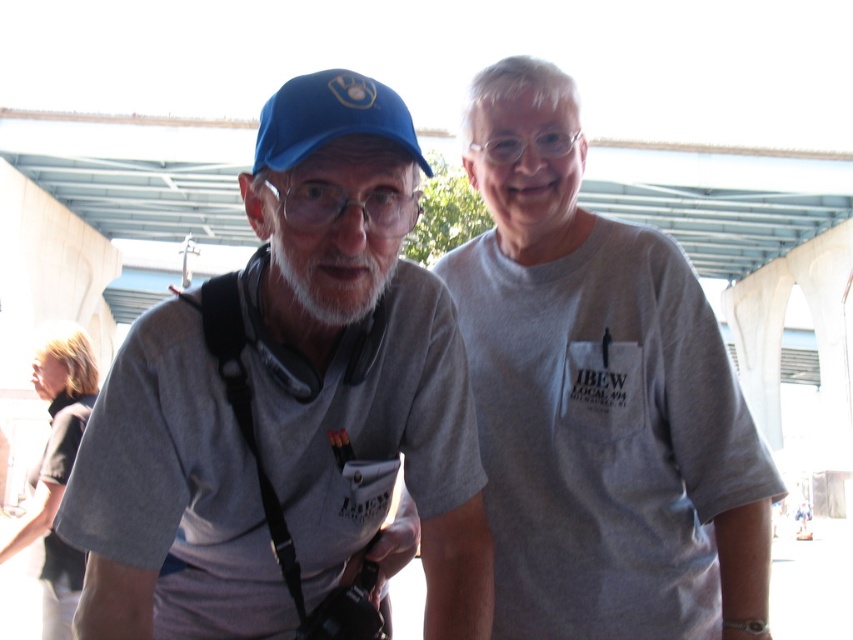
How distant is blue fabric baseball cap at upper left from whitehairbeard at center?

blue fabric baseball cap at upper left and whitehairbeard at center are 5.66 feet apart.

What are the coordinates of `blue fabric baseball cap at upper left` in the screenshot? It's located at (329, 116).

Does gray cotton t-shirt at center have a larger size compared to dark gray shirt at lower left?

Yes, gray cotton t-shirt at center is bigger than dark gray shirt at lower left.

Locate an element on the screen. Image resolution: width=853 pixels, height=640 pixels. gray cotton t-shirt at center is located at coordinates (598, 397).

This screenshot has height=640, width=853. What are the coordinates of `gray cotton t-shirt at center` in the screenshot? It's located at (598, 397).

Where is `gray cotton t-shirt at center`? gray cotton t-shirt at center is located at coordinates (598, 397).

Can you confirm if matte gray t-shirt at left is positioned below dark gray shirt at lower left?

No, matte gray t-shirt at left is not below dark gray shirt at lower left.

Can you confirm if matte gray t-shirt at left is positioned above dark gray shirt at lower left?

Correct, matte gray t-shirt at left is located above dark gray shirt at lower left.

Which is in front, point (183, 477) or point (90, 364)?

Point (183, 477) is more forward.

Locate an element on the screen. The height and width of the screenshot is (640, 853). matte gray t-shirt at left is located at coordinates (358, 352).